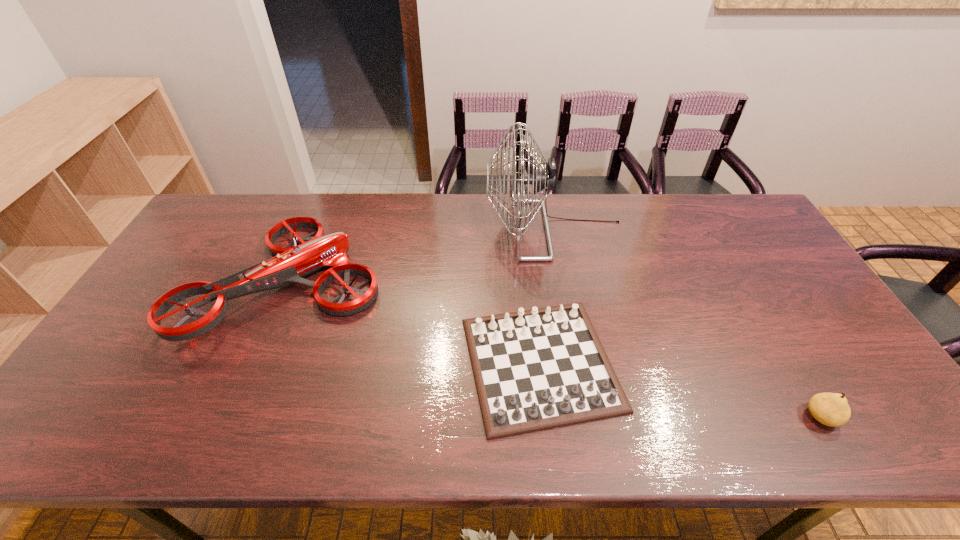
Find the location of `fan positioned at the far edge`. fan positioned at the far edge is located at coordinates (542, 180).

Find the location of a particular element. This screenshot has width=960, height=540. drone located in the far edge section of the desktop is located at coordinates (290, 264).

You are a GUI agent. You are given a task and a screenshot of the screen. Output one action in this format:
    pyautogui.click(x=<x>, y=<y>)
    Task: Click on the pear located at the near edge
    The image size is (960, 540).
    Given the screenshot: What is the action you would take?
    pyautogui.click(x=831, y=409)

Locate an element on the screen. chessboard that is positioned at the near edge is located at coordinates [x=544, y=368].

The width and height of the screenshot is (960, 540). What are the coordinates of `object at the left edge` in the screenshot? It's located at (290, 264).

Identify the location of object located at the right edge. (831, 409).

This screenshot has width=960, height=540. I want to click on object that is positioned at the far left corner, so click(290, 264).

Locate an element on the screen. The width and height of the screenshot is (960, 540). object located in the near right corner section of the desktop is located at coordinates (831, 409).

Identify the location of free space at the far edge of the desktop. The width and height of the screenshot is (960, 540). (364, 232).

Where is `free space at the near edge of the desktop`? The image size is (960, 540). free space at the near edge of the desktop is located at coordinates (760, 442).